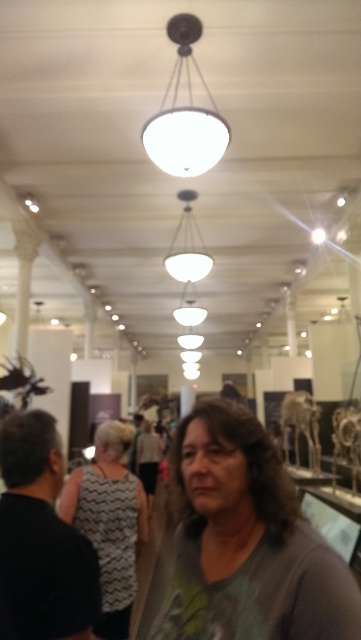
You are an interior designer planning to adjust the lighting in the museum. You notice the gray fabric at center and the white matte light fixture at upper center. Which object is positioned farther away from the viewer?

The white matte light fixture at upper center is farther away from the viewer because it is behind the gray fabric at center.

Based on the photo, you are an artist standing in the museum and you see the gray fabric at center and the gray zigzag dress at center. Which object is closer to you?

The gray fabric at center is closer to you because the gray zigzag dress at center is behind it.